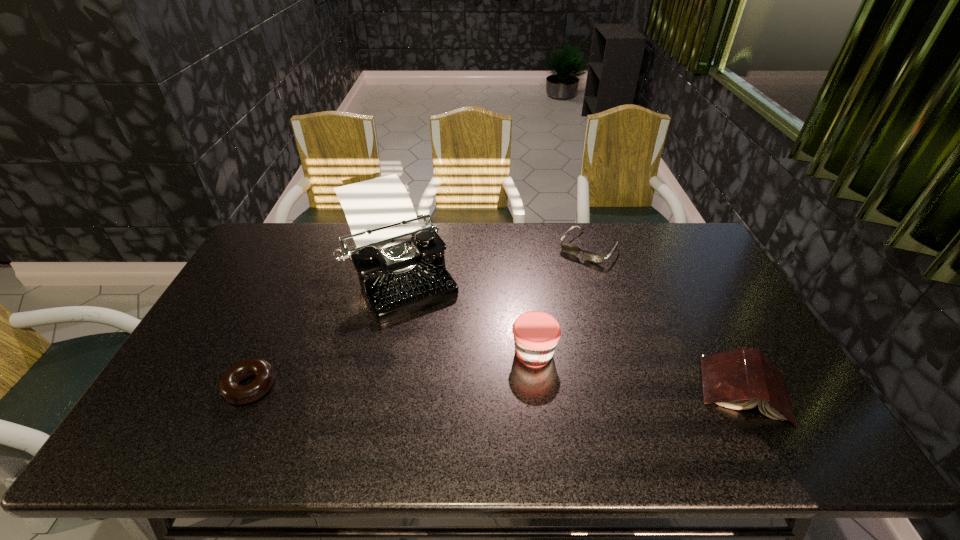
I want to click on vacant space on the desktop that is between the leftmost object and the third shortest object and is positioned on the front label of the jam, so click(x=465, y=388).

This screenshot has height=540, width=960. What are the coordinates of `free space on the desktop that is between the leftmost object and the rightmost object and is positioned on the keys of the second object from left to right` in the screenshot? It's located at (468, 388).

Where is `vacant space on the desktop that is between the leftmost object and the book and is positioned on the front-facing side of the fourth object from left to right`? vacant space on the desktop that is between the leftmost object and the book and is positioned on the front-facing side of the fourth object from left to right is located at coordinates (472, 388).